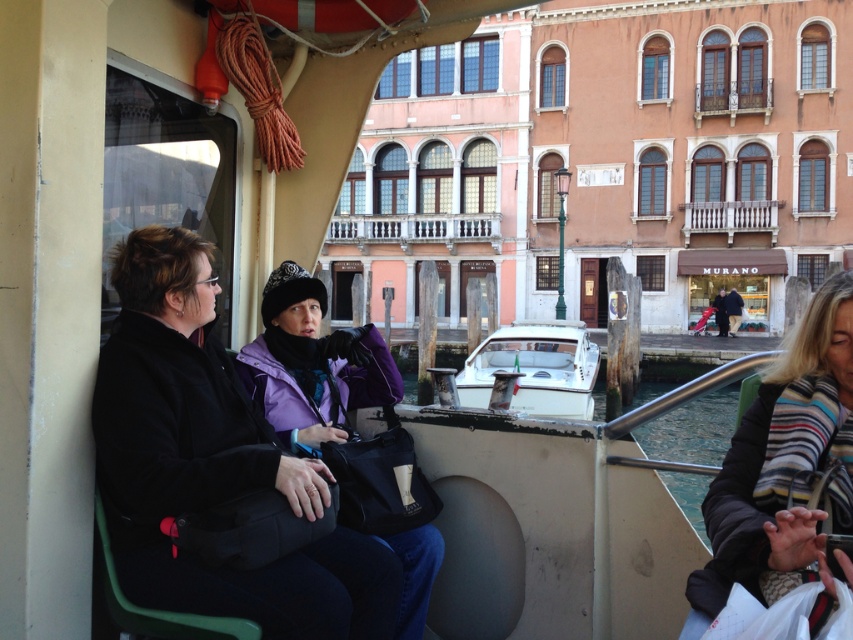
Question: Can you confirm if striped wool scarf at lower right is positioned to the right of purple fleece jacket at center?

Choices:
 (A) no
 (B) yes

Answer: (B)

Question: Which point appears farthest from the camera in this image?

Choices:
 (A) (143, 592)
 (B) (299, 282)

Answer: (B)

Question: Estimate the real-world distances between objects in this image. Which object is farther from the white glossy boat at center?

Choices:
 (A) purple fleece jacket at center
 (B) striped wool scarf at lower right
 (C) black fabric coach at center

Answer: (C)

Question: Can you confirm if striped wool scarf at lower right is thinner than white glossy boat at center?

Choices:
 (A) no
 (B) yes

Answer: (B)

Question: Is striped wool scarf at lower right to the left of purple fleece jacket at center from the viewer's perspective?

Choices:
 (A) no
 (B) yes

Answer: (A)

Question: Which of these objects is positioned closest to the striped wool scarf at lower right?

Choices:
 (A) purple fleece jacket at center
 (B) black fabric coach at center
 (C) white glossy boat at center

Answer: (B)